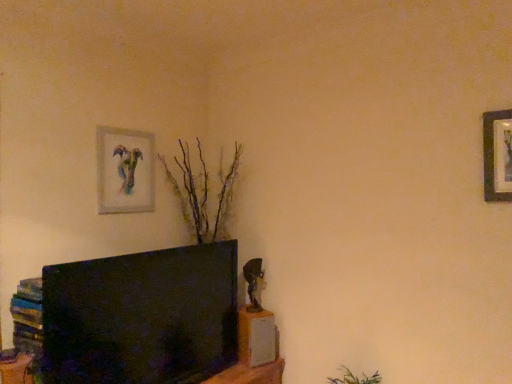
Question: Considering the positions of watercolor paper painting at upper left, the 1th picture frame in the left-to-right sequence, and wooden bookshelf at lower left in the image, is watercolor paper painting at upper left, the 1th picture frame in the left-to-right sequence, taller or shorter than wooden bookshelf at lower left?

Choices:
 (A) tall
 (B) short

Answer: (A)

Question: Considering their positions, is watercolor paper painting at upper left, placed as the first picture frame when sorted from back to front, located in front of or behind wooden bookshelf at lower left?

Choices:
 (A) front
 (B) behind

Answer: (B)

Question: Which of these objects is positioned closest to the wooden picture frame at upper right, which is the 2th picture frame in left-to-right order?

Choices:
 (A) wooden bookshelf at lower left
 (B) watercolor paper painting at upper left, placed as the first picture frame when sorted from back to front

Answer: (B)

Question: Based on their relative distances, which object is farther from the wooden picture frame at upper right, the 2th picture frame in the back-to-front sequence?

Choices:
 (A) wooden bookshelf at lower left
 (B) watercolor paper painting at upper left, placed as the first picture frame when sorted from back to front

Answer: (A)